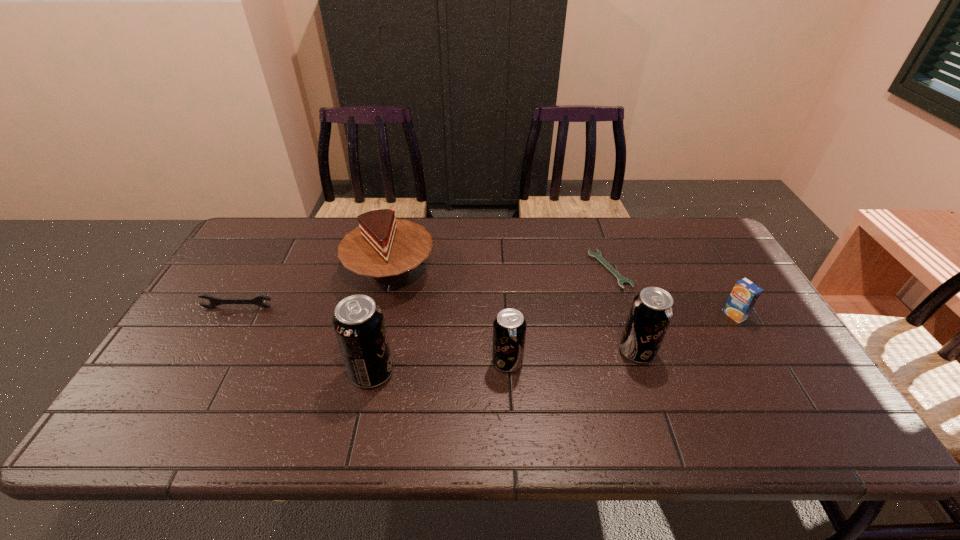
Identify the location of soda can that is the second closest to the second soda can from left to right. Image resolution: width=960 pixels, height=540 pixels. (652, 309).

Locate an element on the screen. This screenshot has height=540, width=960. vacant space that satisfies the following two spatial constraints: 1. on the back side of the right wrench; 2. on the right side of the leftmost soda can is located at coordinates (395, 269).

What are the coordinates of `vacant space that satisfies the following two spatial constraints: 1. on the front side of the orange_juice; 2. on the right side of the cake` in the screenshot? It's located at (381, 315).

Find the location of `free spot that satisfies the following two spatial constraints: 1. on the open ends of the rightmost soda can; 2. on the left side of the taller wrench`. free spot that satisfies the following two spatial constraints: 1. on the open ends of the rightmost soda can; 2. on the left side of the taller wrench is located at coordinates (213, 352).

Locate an element on the screen. blank space that satisfies the following two spatial constraints: 1. on the front side of the farther wrench; 2. on the left side of the second shortest soda can is located at coordinates (636, 352).